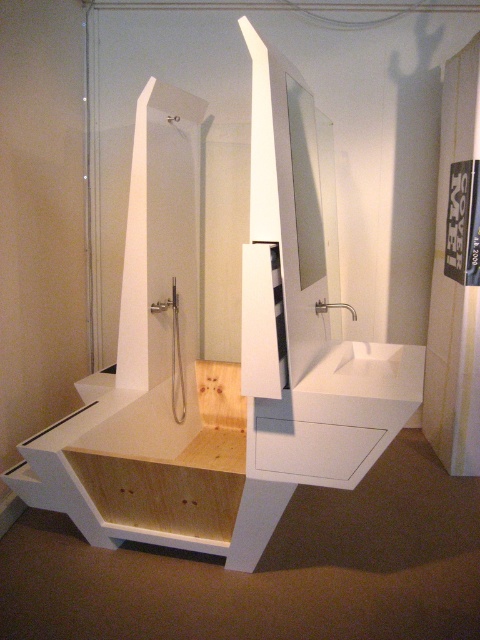
Does white matte sink at center have a greater height compared to clear glass mirror at center?

No.

In the scene shown: Who is taller, white matte sink at center or clear glass mirror at center?

Standing taller between the two is clear glass mirror at center.

Identify the location of white matte sink at center. Image resolution: width=480 pixels, height=640 pixels. pyautogui.click(x=369, y=372).